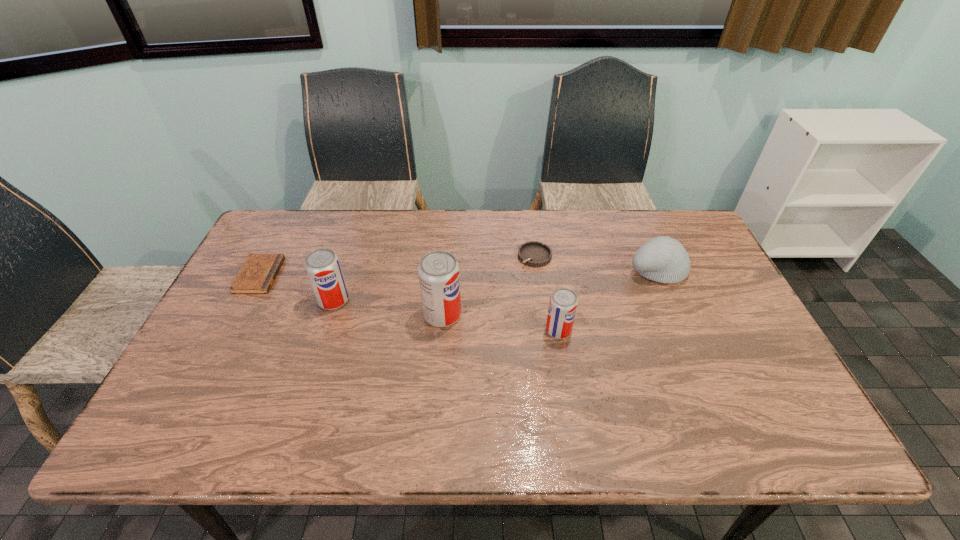
This screenshot has width=960, height=540. I want to click on free location located 0.060m on the back of the tallest object, so click(444, 286).

Where is `free space located on the front of the shortest soda`? free space located on the front of the shortest soda is located at coordinates (567, 388).

Find the location of `vacant position located on the left of the beanie`. vacant position located on the left of the beanie is located at coordinates (525, 269).

The height and width of the screenshot is (540, 960). In order to click on vacant region located 0.180m on the back of the second shortest object in this screenshot , I will do `click(529, 213)`.

Where is `vacant region located 0.280m on the spine side of the leftmost object`? The width and height of the screenshot is (960, 540). vacant region located 0.280m on the spine side of the leftmost object is located at coordinates (371, 275).

Where is `beanie at the far edge`? Image resolution: width=960 pixels, height=540 pixels. beanie at the far edge is located at coordinates (663, 259).

At what (x,y) coordinates should I click in order to perform the action: click on ashtray at the far edge. Please return your answer as a coordinate pair (x, y). This screenshot has width=960, height=540. Looking at the image, I should click on (533, 253).

Find the location of a particular element. The image size is (960, 540). object that is positioned at the left edge is located at coordinates (257, 275).

Locate an element on the screen. Image resolution: width=960 pixels, height=540 pixels. object present at the right edge is located at coordinates (x=663, y=259).

Image resolution: width=960 pixels, height=540 pixels. Find the location of `object that is at the far right corner`. object that is at the far right corner is located at coordinates (663, 259).